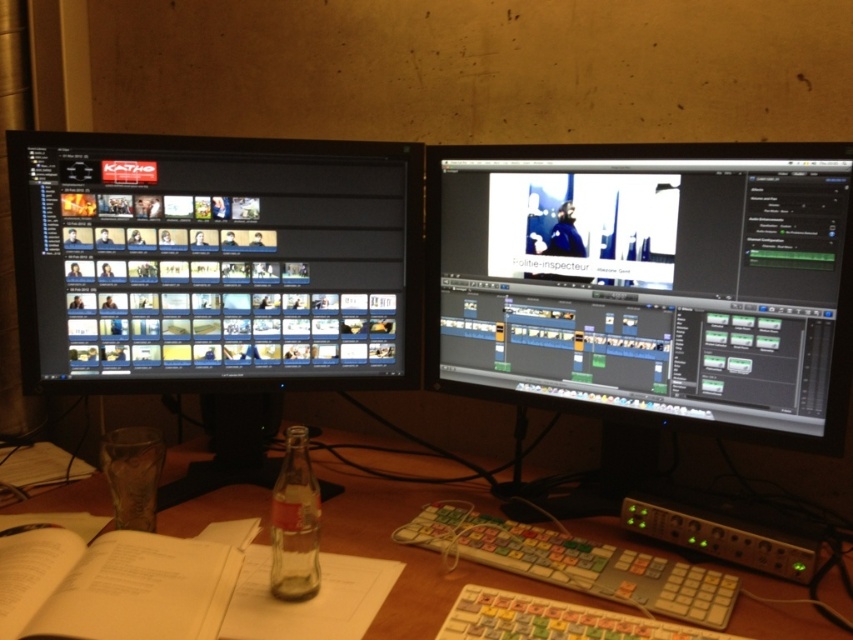
Question: Which object appears closest to the camera in this image?

Choices:
 (A) matte black monitor at center
 (B) black glossy monitor at left

Answer: (A)

Question: Which object is farther from the camera taking this photo?

Choices:
 (A) black glossy monitor at left
 (B) white plastic keyboard at lower center

Answer: (A)

Question: Among these points, which one is nearest to the camera?

Choices:
 (A) (294, 444)
 (B) (720, 621)

Answer: (B)

Question: Can you confirm if matte black monitor at center is smaller than white paper book at lower left?

Choices:
 (A) yes
 (B) no

Answer: (B)

Question: In this image, where is matte black monitor at center located relative to wooden table at center?

Choices:
 (A) right
 (B) left

Answer: (A)

Question: Does matte black monitor at center appear on the right side of white plastic keyboard at lower center?

Choices:
 (A) yes
 (B) no

Answer: (A)